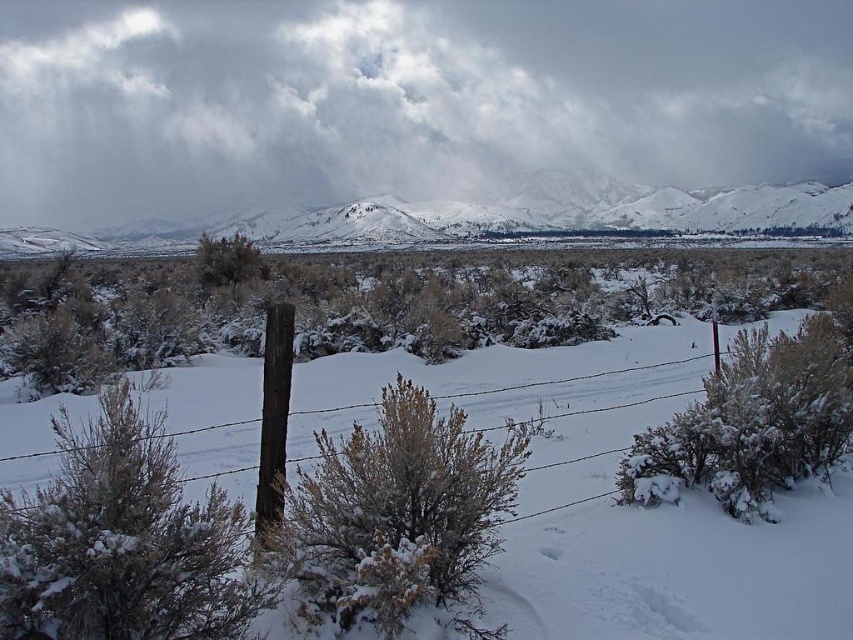
Is point (440, 440) positioned before point (244, 241)?

Yes, point (440, 440) is in front of point (244, 241).

Can you confirm if fuzzy snow-covered bush at center is positioned below brown textured bush at center?

Yes.

Describe the element at coordinates (395, 513) in the screenshot. Image resolution: width=853 pixels, height=640 pixels. I see `fuzzy snow-covered bush at center` at that location.

Where is `fuzzy snow-covered bush at center`? fuzzy snow-covered bush at center is located at coordinates (395, 513).

Does white fluffy bush at center have a greater width compared to brown textured bush at center?

No, white fluffy bush at center is not wider than brown textured bush at center.

Is white fluffy bush at center to the left of brown textured bush at center from the viewer's perspective?

No, white fluffy bush at center is not to the left of brown textured bush at center.

Is point (753, 484) positioned before point (257, 248)?

Yes, it is.

This screenshot has width=853, height=640. Identify the location of white fluffy bush at center. (750, 422).

Does point (317, 589) lie in front of point (274, 316)?

Yes, point (317, 589) is in front of point (274, 316).

Is point (432, 518) farther from viewer compared to point (286, 412)?

No, it is in front of (286, 412).

Find the location of a particular element. The width and height of the screenshot is (853, 640). fuzzy snow-covered bush at center is located at coordinates (395, 513).